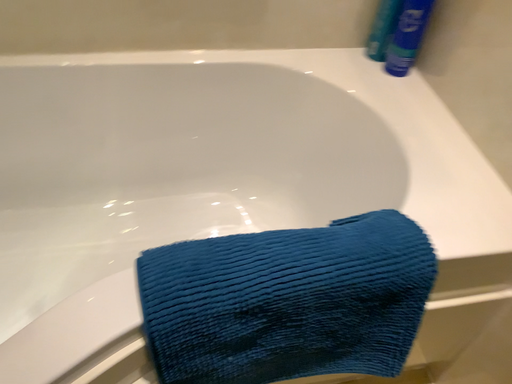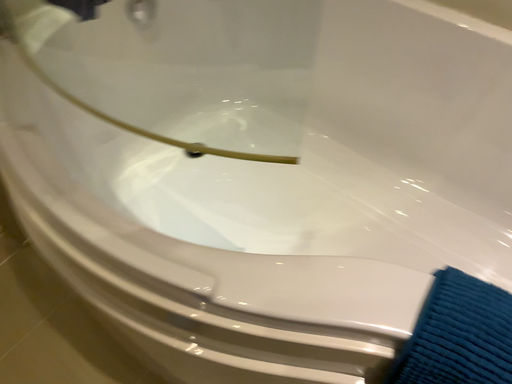
Question: How did the camera likely rotate when shooting the video?

Choices:
 (A) rotated downward
 (B) rotated upward

Answer: (B)